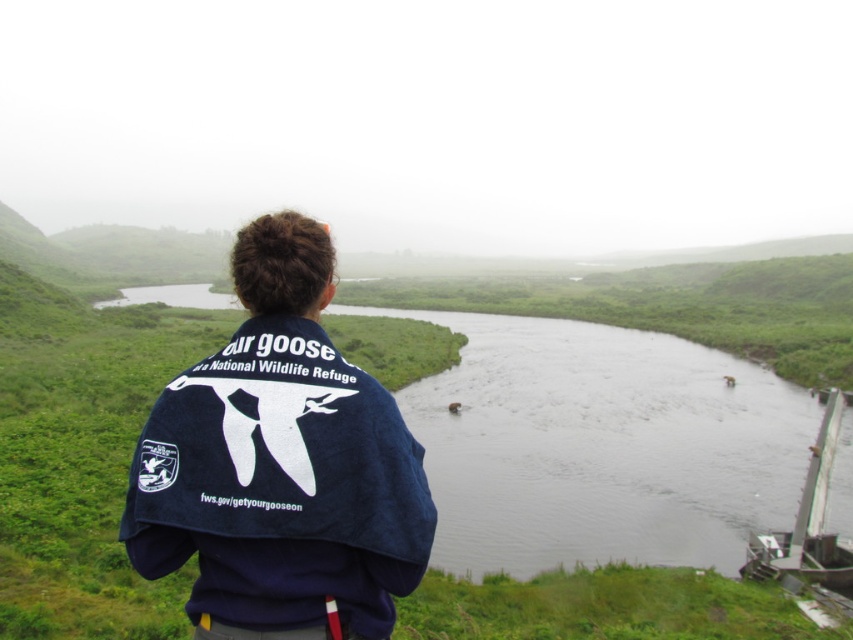
Which is above, dark water at center or denim jacket at center?

Positioned higher is denim jacket at center.

Is dark water at center wider than denim jacket at center?

Yes, dark water at center is wider than denim jacket at center.

Does point (699, 388) lie in front of point (296, 484)?

That is False.

I want to click on dark water at center, so click(601, 445).